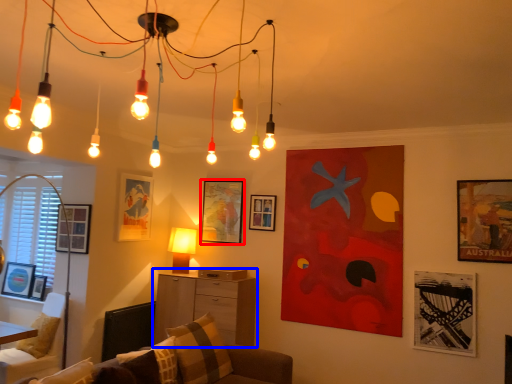
Question: Which object is further to the camera taking this photo, picture frame (highlighted by a red box) or dresser (highlighted by a blue box)?

Choices:
 (A) picture frame
 (B) dresser

Answer: (A)